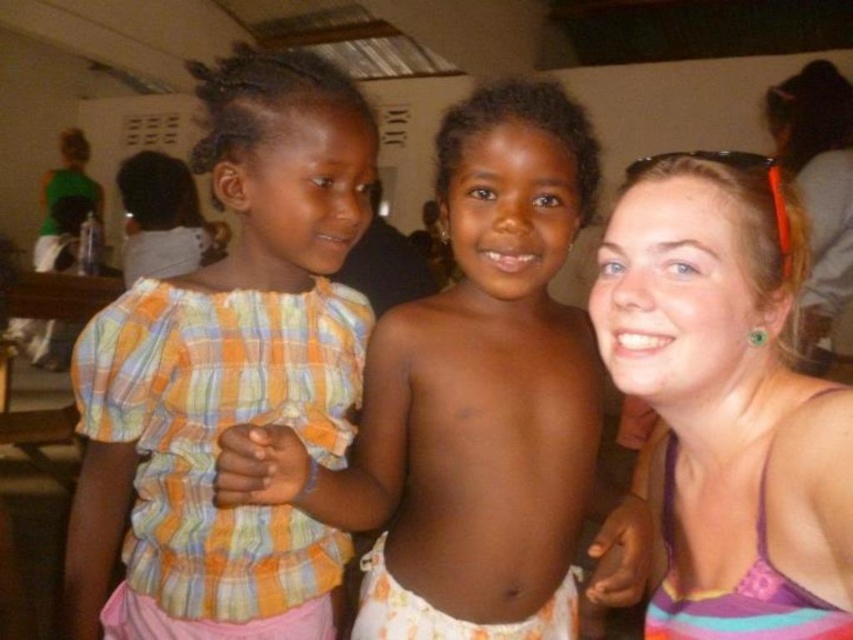
Which is in front, point (503, 564) or point (122, 637)?

Point (503, 564)

Between plaid fabric shirt at center and pink fabric at lower left, which one is positioned lower?

pink fabric at lower left is lower down.

What do you see at coordinates (469, 396) in the screenshot? This screenshot has width=853, height=640. I see `plaid fabric shirt at center` at bounding box center [469, 396].

Find the location of a particular element. This screenshot has height=640, width=853. plaid fabric shirt at center is located at coordinates (469, 396).

Can you confirm if white cotton shorts at center is wider than pink fabric at lower left?

Indeed, white cotton shorts at center has a greater width compared to pink fabric at lower left.

Is white cotton shorts at center smaller than pink fabric at lower left?

Incorrect, white cotton shorts at center is not smaller in size than pink fabric at lower left.

Is point (380, 627) positioned behind point (200, 624)?

Yes, point (380, 627) is farther from viewer.

Locate an element on the screen. The image size is (853, 640). white cotton shorts at center is located at coordinates (450, 614).

Between plaid fabric shirt at left and pink fabric tank top at right, which one appears on the left side from the viewer's perspective?

From the viewer's perspective, plaid fabric shirt at left appears more on the left side.

Which of these two, plaid fabric shirt at left or pink fabric tank top at right, stands taller?

plaid fabric shirt at left is taller.

Does point (186, 371) lie in front of point (689, 504)?

No, it is not.

You are a GUI agent. You are given a task and a screenshot of the screen. Output one action in this format:
    pyautogui.click(x=<x>, y=<y>)
    Task: Click on the plaid fabric shirt at left
    
    Given the screenshot: What is the action you would take?
    pyautogui.click(x=229, y=372)